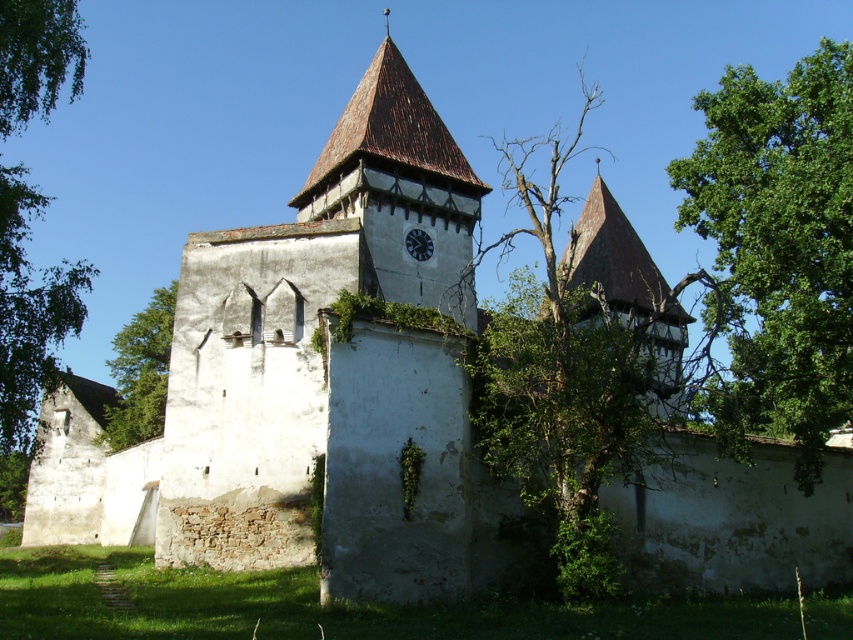
Does green leafy tree at left have a lesser height compared to green leafy tree at center?

Incorrect, green leafy tree at left's height does not fall short of green leafy tree at center's.

Which is in front, point (1, 220) or point (141, 326)?

Positioned in front is point (1, 220).

Who is more distant from viewer, [15,29] or [143,412]?

The point [143,412] is more distant.

Where is `green leafy tree at left`? The image size is (853, 640). green leafy tree at left is located at coordinates (28, 310).

Who is more distant from viewer, (135, 330) or (413, 243)?

Positioned behind is point (135, 330).

Is green leafy tree at center smaller than matte black clock at center?

No.

What do you see at coordinates (140, 372) in the screenshot?
I see `green leafy tree at center` at bounding box center [140, 372].

Locate an element on the screen. The width and height of the screenshot is (853, 640). green leafy tree at center is located at coordinates (140, 372).

Consider the image. Between green leafy tree at upper right and green leafy tree at center, which one has less height?

With less height is green leafy tree at center.

Can you confirm if green leafy tree at upper right is bigger than green leafy tree at center?

Yes.

Between point (761, 381) and point (131, 426), which one is positioned behind?

The point (131, 426) is more distant.

Image resolution: width=853 pixels, height=640 pixels. Find the location of `green leafy tree at upper right`. green leafy tree at upper right is located at coordinates (778, 250).